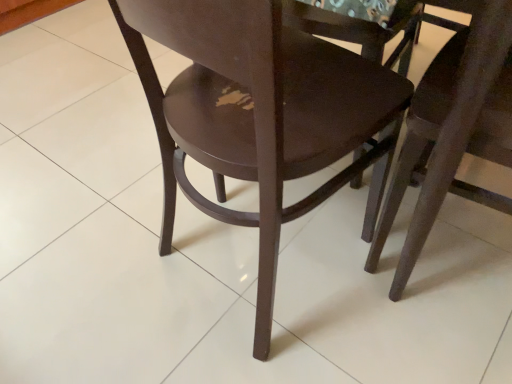
The image size is (512, 384). What do you see at coordinates (258, 113) in the screenshot?
I see `glossy wood chair at center, marked as the 2th chair in a right-to-left arrangement` at bounding box center [258, 113].

Find the location of a particular element. The height and width of the screenshot is (384, 512). glossy wood chair at center, marked as the 2th chair in a right-to-left arrangement is located at coordinates (258, 113).

The height and width of the screenshot is (384, 512). I want to click on dark wood chair at center, positioned as the 1th chair in right-to-left order, so click(453, 131).

What do you see at coordinates (453, 131) in the screenshot? The width and height of the screenshot is (512, 384). I see `dark wood chair at center, positioned as the second chair in left-to-right order` at bounding box center [453, 131].

Identify the location of glossy wood chair at center, marked as the 2th chair in a right-to-left arrangement. (258, 113).

Between glossy wood chair at center, placed as the 1th chair when sorted from left to right, and dark wood chair at center, positioned as the second chair in left-to-right order, which one appears on the left side from the viewer's perspective?

glossy wood chair at center, placed as the 1th chair when sorted from left to right.

Is glossy wood chair at center, marked as the 2th chair in a right-to-left arrangement, in front of dark wood chair at center, positioned as the second chair in left-to-right order?

Yes.

Considering the positions of point (244, 113) and point (485, 57), is point (244, 113) closer or farther from the camera than point (485, 57)?

Point (244, 113) appears to be farther away from the viewer than point (485, 57).

From the image's perspective, between glossy wood chair at center, placed as the 1th chair when sorted from left to right, and dark wood chair at center, positioned as the second chair in left-to-right order, who is located below?

From the image's view, dark wood chair at center, positioned as the second chair in left-to-right order, is below.

From a real-world perspective, who is located higher, glossy wood chair at center, placed as the 1th chair when sorted from left to right, or dark wood chair at center, positioned as the second chair in left-to-right order?

From a 3D spatial view, glossy wood chair at center, placed as the 1th chair when sorted from left to right, is above.

Considering the relative sizes of glossy wood chair at center, marked as the 2th chair in a right-to-left arrangement, and dark wood chair at center, positioned as the 1th chair in right-to-left order, in the image provided, is glossy wood chair at center, marked as the 2th chair in a right-to-left arrangement, wider than dark wood chair at center, positioned as the 1th chair in right-to-left order,?

Correct, the width of glossy wood chair at center, marked as the 2th chair in a right-to-left arrangement, exceeds that of dark wood chair at center, positioned as the 1th chair in right-to-left order.

Considering the sizes of glossy wood chair at center, marked as the 2th chair in a right-to-left arrangement, and dark wood chair at center, positioned as the 1th chair in right-to-left order, in the image, is glossy wood chair at center, marked as the 2th chair in a right-to-left arrangement, taller or shorter than dark wood chair at center, positioned as the 1th chair in right-to-left order,?

glossy wood chair at center, marked as the 2th chair in a right-to-left arrangement, is taller than dark wood chair at center, positioned as the 1th chair in right-to-left order.

Looking at the image, does glossy wood chair at center, marked as the 2th chair in a right-to-left arrangement, seem bigger or smaller compared to dark wood chair at center, positioned as the second chair in left-to-right order?

Clearly, glossy wood chair at center, marked as the 2th chair in a right-to-left arrangement, is larger in size than dark wood chair at center, positioned as the second chair in left-to-right order.

Would you say glossy wood chair at center, marked as the 2th chair in a right-to-left arrangement, contains dark wood chair at center, positioned as the second chair in left-to-right order?

No, dark wood chair at center, positioned as the second chair in left-to-right order, is not surrounded by glossy wood chair at center, marked as the 2th chair in a right-to-left arrangement.

Is glossy wood chair at center, placed as the 1th chair when sorted from left to right, not close to dark wood chair at center, positioned as the 1th chair in right-to-left order?

No, glossy wood chair at center, placed as the 1th chair when sorted from left to right, is in close proximity to dark wood chair at center, positioned as the 1th chair in right-to-left order.

Is glossy wood chair at center, placed as the 1th chair when sorted from left to right, oriented away from dark wood chair at center, positioned as the 1th chair in right-to-left order?

No, dark wood chair at center, positioned as the 1th chair in right-to-left order, is not at the back of glossy wood chair at center, placed as the 1th chair when sorted from left to right.

How different are the orientations of glossy wood chair at center, placed as the 1th chair when sorted from left to right, and dark wood chair at center, positioned as the 1th chair in right-to-left order, in degrees?

The facing directions of glossy wood chair at center, placed as the 1th chair when sorted from left to right, and dark wood chair at center, positioned as the 1th chair in right-to-left order, are 106 degrees apart.

How much distance is there between glossy wood chair at center, marked as the 2th chair in a right-to-left arrangement, and dark wood chair at center, positioned as the second chair in left-to-right order?

23.05 centimeters.

This screenshot has width=512, height=384. I want to click on chair below the glossy wood chair at center, marked as the 2th chair in a right-to-left arrangement (from a real-world perspective), so click(453, 131).

Would you say dark wood chair at center, positioned as the second chair in left-to-right order, is to the left or to the right of glossy wood chair at center, marked as the 2th chair in a right-to-left arrangement, in the picture?

From the image, it's evident that dark wood chair at center, positioned as the second chair in left-to-right order, is to the right of glossy wood chair at center, marked as the 2th chair in a right-to-left arrangement.

Considering their positions, is dark wood chair at center, positioned as the second chair in left-to-right order, located in front of or behind glossy wood chair at center, marked as the 2th chair in a right-to-left arrangement?

Visually, dark wood chair at center, positioned as the second chair in left-to-right order, is located behind glossy wood chair at center, marked as the 2th chair in a right-to-left arrangement.

Between point (400, 160) and point (249, 12), which one is positioned in front?

The point (249, 12) is closer to the camera.

From the image's perspective, is dark wood chair at center, positioned as the 1th chair in right-to-left order, under glossy wood chair at center, placed as the 1th chair when sorted from left to right?

Yes.

From a real-world perspective, is dark wood chair at center, positioned as the 1th chair in right-to-left order, below glossy wood chair at center, placed as the 1th chair when sorted from left to right?

Yes, from a real-world perspective, dark wood chair at center, positioned as the 1th chair in right-to-left order, is below glossy wood chair at center, placed as the 1th chair when sorted from left to right.

Between dark wood chair at center, positioned as the second chair in left-to-right order, and glossy wood chair at center, placed as the 1th chair when sorted from left to right, which one has smaller width?

With smaller width is dark wood chair at center, positioned as the second chair in left-to-right order.

Which of these two, dark wood chair at center, positioned as the second chair in left-to-right order, or glossy wood chair at center, placed as the 1th chair when sorted from left to right, stands shorter?

dark wood chair at center, positioned as the second chair in left-to-right order.

Considering the sizes of dark wood chair at center, positioned as the second chair in left-to-right order, and glossy wood chair at center, marked as the 2th chair in a right-to-left arrangement, in the image, is dark wood chair at center, positioned as the second chair in left-to-right order, bigger or smaller than glossy wood chair at center, marked as the 2th chair in a right-to-left arrangement,?

Clearly, dark wood chair at center, positioned as the second chair in left-to-right order, is smaller in size than glossy wood chair at center, marked as the 2th chair in a right-to-left arrangement.

Can we say dark wood chair at center, positioned as the second chair in left-to-right order, lies outside glossy wood chair at center, placed as the 1th chair when sorted from left to right?

Indeed, dark wood chair at center, positioned as the second chair in left-to-right order, is completely outside glossy wood chair at center, placed as the 1th chair when sorted from left to right.

Can you see dark wood chair at center, positioned as the second chair in left-to-right order, touching glossy wood chair at center, placed as the 1th chair when sorted from left to right?

No, dark wood chair at center, positioned as the second chair in left-to-right order, is not beside glossy wood chair at center, placed as the 1th chair when sorted from left to right.

Is dark wood chair at center, positioned as the 1th chair in right-to-left order, looking in the opposite direction of glossy wood chair at center, marked as the 2th chair in a right-to-left arrangement?

No.

How different are the orientations of dark wood chair at center, positioned as the 1th chair in right-to-left order, and glossy wood chair at center, placed as the 1th chair when sorted from left to right, in degrees?

The facing directions of dark wood chair at center, positioned as the 1th chair in right-to-left order, and glossy wood chair at center, placed as the 1th chair when sorted from left to right, are 106 degrees apart.

Could you measure the distance between dark wood chair at center, positioned as the 1th chair in right-to-left order, and glossy wood chair at center, placed as the 1th chair when sorted from left to right?

dark wood chair at center, positioned as the 1th chair in right-to-left order, is 9.07 inches away from glossy wood chair at center, placed as the 1th chair when sorted from left to right.

Where is `chair that is below the glossy wood chair at center, marked as the 2th chair in a right-to-left arrangement (from the image's perspective)`? chair that is below the glossy wood chair at center, marked as the 2th chair in a right-to-left arrangement (from the image's perspective) is located at coordinates (453, 131).

Where is `chair behind the glossy wood chair at center, placed as the 1th chair when sorted from left to right`? The width and height of the screenshot is (512, 384). chair behind the glossy wood chair at center, placed as the 1th chair when sorted from left to right is located at coordinates (453, 131).

You are a GUI agent. You are given a task and a screenshot of the screen. Output one action in this format:
    pyautogui.click(x=<x>, y=<y>)
    Task: Click on the chair above the dark wood chair at center, positioned as the second chair in left-to-right order (from the image's perspective)
    This screenshot has width=512, height=384.
    Given the screenshot: What is the action you would take?
    pyautogui.click(x=258, y=113)